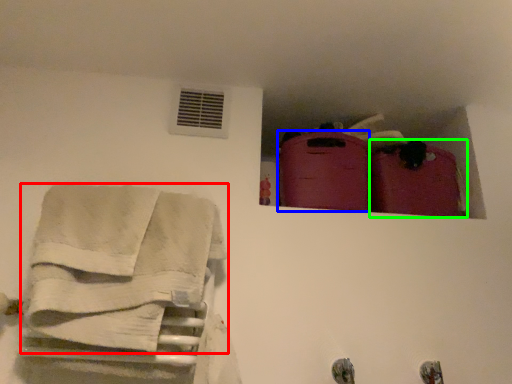
Question: Which object is the closest to the towel (highlighted by a red box)? Choose among these: luggage (highlighted by a blue box) or luggage (highlighted by a green box).

Choices:
 (A) luggage
 (B) luggage

Answer: (A)